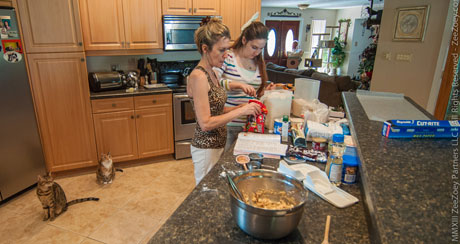
Where is `window`? The height and width of the screenshot is (244, 460). window is located at coordinates (289, 44), (271, 44).